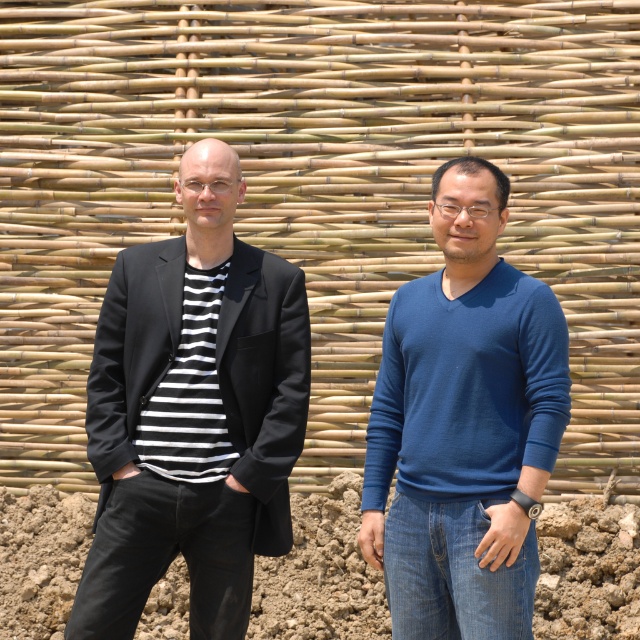
Question: From the image, what is the correct spatial relationship of black matte suit at left in relation to blue smooth sweater at center?

Choices:
 (A) right
 (B) left

Answer: (A)

Question: Is black matte blazer at left positioned behind black matte suit at left?

Choices:
 (A) no
 (B) yes

Answer: (B)

Question: Which of these objects is positioned farthest from the black matte suit at left?

Choices:
 (A) black matte blazer at left
 (B) blue smooth sweater at center

Answer: (A)

Question: Which is farther from the black matte blazer at left?

Choices:
 (A) blue smooth sweater at center
 (B) black matte suit at left

Answer: (A)

Question: Considering the real-world distances, which object is closest to the black matte blazer at left?

Choices:
 (A) black matte suit at left
 (B) blue smooth sweater at center

Answer: (A)

Question: Can you confirm if black matte blazer at left is positioned to the right of black matte suit at left?

Choices:
 (A) no
 (B) yes

Answer: (A)